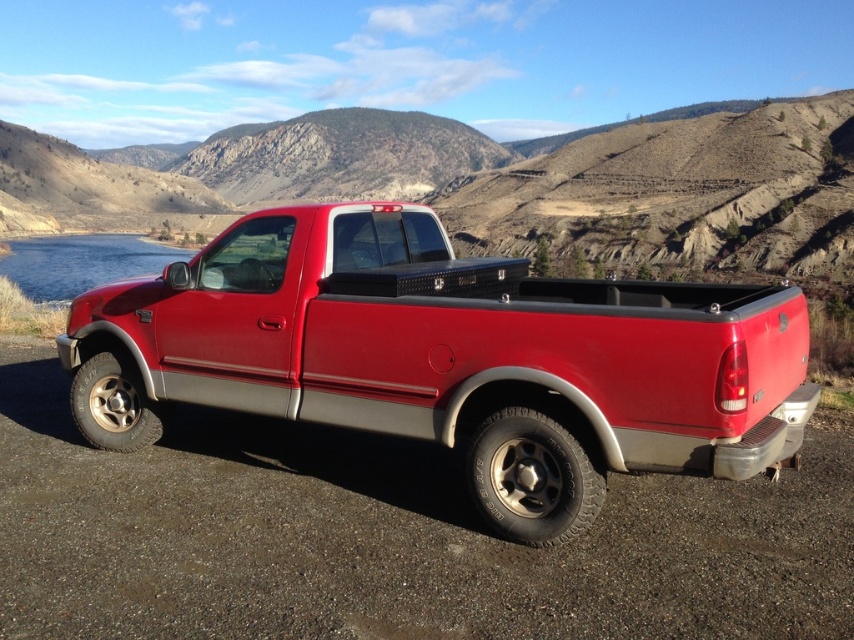
This screenshot has width=854, height=640. What do you see at coordinates (449, 358) in the screenshot?
I see `matte red truck at center` at bounding box center [449, 358].

Does matte red truck at center have a larger size compared to blue glassy water at left?

No, matte red truck at center is not bigger than blue glassy water at left.

Is point (515, 396) positioned after point (138, 236)?

That is False.

Where is `matte red truck at center`? The image size is (854, 640). matte red truck at center is located at coordinates (449, 358).